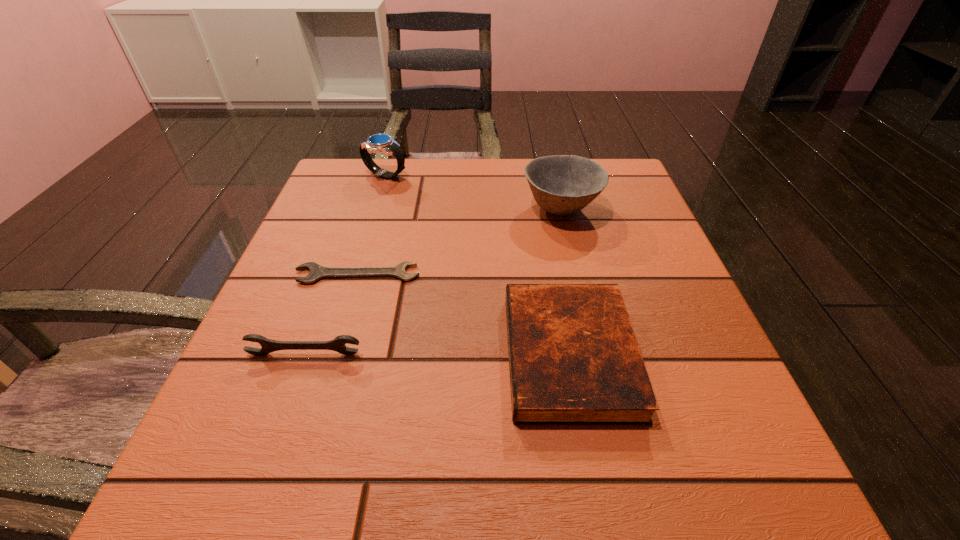
Locate an element on the screen. Image resolution: width=960 pixels, height=540 pixels. blank area located on the spine side of the Bible is located at coordinates (282, 355).

Locate an element on the screen. free space located 0.340m on the spine side of the Bible is located at coordinates (289, 355).

This screenshot has width=960, height=540. Identify the location of vacant area situated on the front of the shortest object. click(304, 452).

Locate an element on the screen. This screenshot has width=960, height=540. watch that is at the far edge is located at coordinates (378, 143).

The width and height of the screenshot is (960, 540). Find the location of `bowl at the far edge`. bowl at the far edge is located at coordinates (561, 184).

Image resolution: width=960 pixels, height=540 pixels. I want to click on watch located in the left edge section of the desktop, so click(378, 143).

The image size is (960, 540). I want to click on bowl located at the right edge, so click(561, 184).

Image resolution: width=960 pixels, height=540 pixels. What are the coordinates of `Bible situated at the right edge` in the screenshot? It's located at (574, 359).

Locate an element on the screen. The height and width of the screenshot is (540, 960). object that is at the far left corner is located at coordinates (378, 143).

Find the location of a particular element. This screenshot has width=960, height=540. object present at the far right corner is located at coordinates (561, 184).